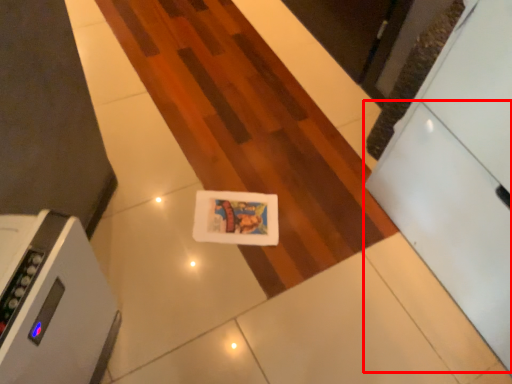
Question: Where is drawer (annotated by the red box) located in relation to home appliance in the image?

Choices:
 (A) left
 (B) right

Answer: (B)